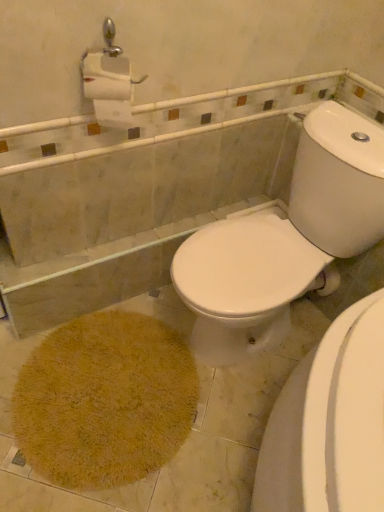
Find the location of a particular element. free point above yellow shaggy bath mat at lower left (from a real-world perspective) is located at coordinates (103, 381).